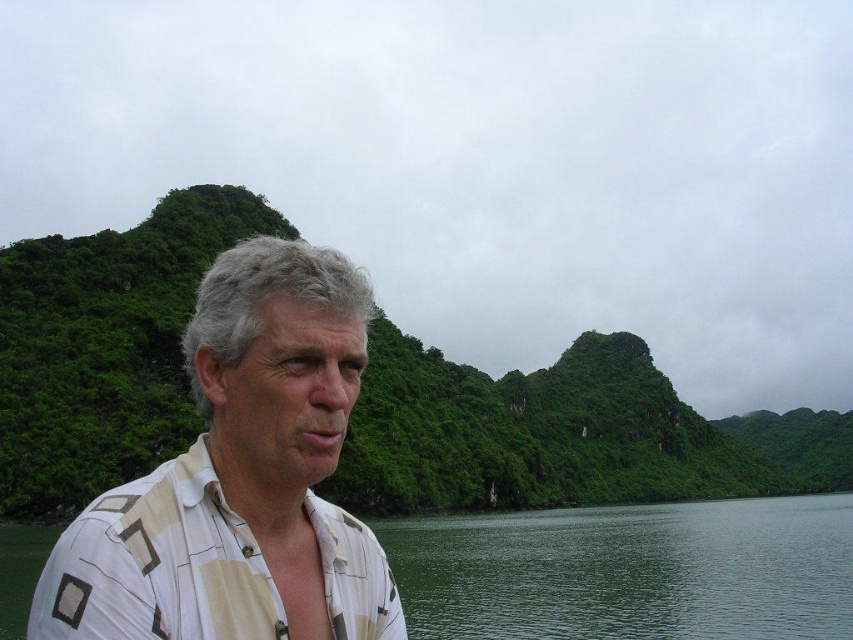
You are an observer looking at the man in the image. The man is wearing a white striped shirt at center. There is also green water at lower left. Which object has a smaller width?

The white striped shirt at center has a smaller width than the green water at lower left.

Based on the scene description, where is the white striped shirt at center located in terms of coordinates?

The white striped shirt at center is located at coordinates point (241, 477).